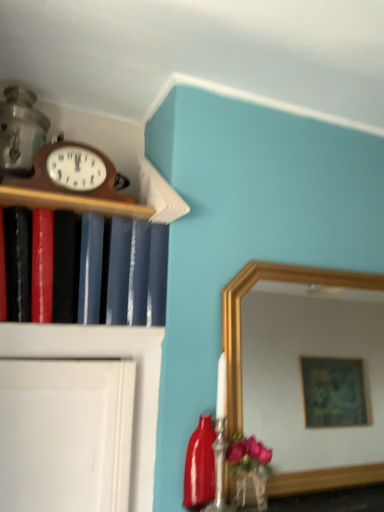
Where is `glossy ceramic bottle at lower right`? Image resolution: width=384 pixels, height=512 pixels. glossy ceramic bottle at lower right is located at coordinates (200, 465).

Is glossy ceramic bottle at lower right turned away from woodenmaterial/texture wall clock at upper left?

No, glossy ceramic bottle at lower right is not facing away from woodenmaterial/texture wall clock at upper left.

Considering the relative sizes of glossy ceramic bottle at lower right and woodenmaterial/texture wall clock at upper left in the image provided, is glossy ceramic bottle at lower right smaller than woodenmaterial/texture wall clock at upper left?

Yes, glossy ceramic bottle at lower right is smaller than woodenmaterial/texture wall clock at upper left.

Can you confirm if glossy ceramic bottle at lower right is positioned to the right of woodenmaterial/texture wall clock at upper left?

Indeed, glossy ceramic bottle at lower right is positioned on the right side of woodenmaterial/texture wall clock at upper left.

You are a GUI agent. You are given a task and a screenshot of the screen. Output one action in this format:
    pyautogui.click(x=<x>, y=<y>)
    Task: Click on the wall clock in front of the glossy ceramic bottle at lower right
    The height and width of the screenshot is (512, 384).
    Given the screenshot: What is the action you would take?
    click(x=71, y=173)

Between matte black book at left and wooden clock at upper left, which one appears on the right side from the viewer's perspective?

From the viewer's perspective, wooden clock at upper left appears more on the right side.

There is a matte black book at left. Identify the location of shelf above it (from a real-world perspective). This screenshot has width=384, height=512. click(71, 202).

Who is more distant, matte black book at left or wooden clock at upper left?

Answer: wooden clock at upper left is behind.

From a real-world perspective, is matte black book at left located higher than wooden clock at upper left?

Incorrect, from a real-world perspective, matte black book at left is lower than wooden clock at upper left.

Is there a large distance between wooden clock at upper left and matte black book at left?

wooden clock at upper left is actually quite close to matte black book at left.

From a real-world perspective, is wooden clock at upper left physically below matte black book at left?

No, from a real-world perspective, wooden clock at upper left is not below matte black book at left.

From the image's perspective, which object appears higher, wooden clock at upper left or matte black book at left?

A: wooden clock at upper left is shown above in the image.

Identify the location of shelf on the right of matte black book at left. This screenshot has height=512, width=384. [x=71, y=202].

Based on the photo, is wooden clock at upper left facing away from woodenmaterial/texture wall clock at upper left?

No, wooden clock at upper left is not facing away from woodenmaterial/texture wall clock at upper left.

Where is `wall clock above the wooden clock at upper left (from a real-world perspective)`? wall clock above the wooden clock at upper left (from a real-world perspective) is located at coordinates (71, 173).

Based on the photo, from the image's perspective, would you say wooden clock at upper left is positioned over woodenmaterial/texture wall clock at upper left?

Incorrect, from the image's perspective, wooden clock at upper left is lower than woodenmaterial/texture wall clock at upper left.

From a real-world perspective, is wooden clock at upper left over woodenmaterial/texture wall clock at upper left?

No, from a real-world perspective, wooden clock at upper left is not over woodenmaterial/texture wall clock at upper left

In the image, is woodenmaterial/texture wall clock at upper left positioned in front of or behind glossy ceramic bottle at lower right?

Visually, woodenmaterial/texture wall clock at upper left is located in front of glossy ceramic bottle at lower right.

From the image's perspective, is woodenmaterial/texture wall clock at upper left located above or below glossy ceramic bottle at lower right?

Based on their image positions, woodenmaterial/texture wall clock at upper left is located above glossy ceramic bottle at lower right.

Is woodenmaterial/texture wall clock at upper left touching glossy ceramic bottle at lower right?

woodenmaterial/texture wall clock at upper left is not next to glossy ceramic bottle at lower right, and they're not touching.

From a real-world perspective, which is physically below, woodenmaterial/texture wall clock at upper left or glossy ceramic bottle at lower right?

glossy ceramic bottle at lower right, from a real-world perspective.

Would you say woodenmaterial/texture wall clock at upper left is outside matte black book at left?

Absolutely, woodenmaterial/texture wall clock at upper left is external to matte black book at left.

I want to click on book in front of the woodenmaterial/texture wall clock at upper left, so click(x=110, y=271).

Is woodenmaterial/texture wall clock at upper left with matte black book at left?

No, woodenmaterial/texture wall clock at upper left is not in contact with matte black book at left.

From the image's perspective, does woodenmaterial/texture wall clock at upper left appear higher than matte black book at left?

Yes, from the image's perspective, woodenmaterial/texture wall clock at upper left is above matte black book at left.

Which is more to the left, glossy ceramic bottle at lower right or matte black book at left?

matte black book at left.

Does point (200, 444) come farther from viewer compared to point (85, 262)?

Yes.

Between glossy ceramic bottle at lower right and matte black book at left, which one has larger width?

matte black book at left is wider.

From the picture: Choose the correct answer: Is glossy ceramic bottle at lower right inside matte black book at left or outside it?

glossy ceramic bottle at lower right cannot be found inside matte black book at left.

I want to click on wall clock above the glossy ceramic bottle at lower right (from the image's perspective), so click(x=71, y=173).

What are the coordinates of `shelf behind the matte black book at left` in the screenshot? It's located at (71, 202).

From the image, which object appears to be nearer to woodenmaterial/texture wall clock at upper left, matte black book at left or wooden clock at upper left?

Based on the image, wooden clock at upper left appears to be nearer to woodenmaterial/texture wall clock at upper left.

Considering their positions, is matte black book at left positioned closer to wooden clock at upper left than glossy ceramic bottle at lower right?

The object closer to wooden clock at upper left is matte black book at left.

Based on their spatial positions, is wooden clock at upper left or woodenmaterial/texture wall clock at upper left closer to matte black book at left?

wooden clock at upper left is positioned closer to the anchor matte black book at left.

Estimate the real-world distances between objects in this image. Which object is closer to glossy ceramic bottle at lower right, wooden clock at upper left or matte black book at left?

Based on the image, matte black book at left appears to be nearer to glossy ceramic bottle at lower right.

Looking at the image, which one is located closer to glossy ceramic bottle at lower right, matte black book at left or wooden clock at upper left?

matte black book at left is closer to glossy ceramic bottle at lower right.

Looking at the image, which one is located closer to glossy ceramic bottle at lower right, matte black book at left or woodenmaterial/texture wall clock at upper left?

matte black book at left lies closer to glossy ceramic bottle at lower right than the other object.

Looking at the image, which one is located further to woodenmaterial/texture wall clock at upper left, matte black book at left or glossy ceramic bottle at lower right?

glossy ceramic bottle at lower right is positioned further to the anchor woodenmaterial/texture wall clock at upper left.

Estimate the real-world distances between objects in this image. Which object is further from matte black book at left, woodenmaterial/texture wall clock at upper left or glossy ceramic bottle at lower right?

Among the two, glossy ceramic bottle at lower right is located further to matte black book at left.

This screenshot has width=384, height=512. Identify the location of shelf between woodenmaterial/texture wall clock at upper left and matte black book at left from top to bottom. coord(71,202).

The height and width of the screenshot is (512, 384). I want to click on shelf between woodenmaterial/texture wall clock at upper left and glossy ceramic bottle at lower right in the up-down direction, so click(71, 202).

Where is `book between wooden clock at upper left and glossy ceramic bottle at lower right vertically`? This screenshot has width=384, height=512. book between wooden clock at upper left and glossy ceramic bottle at lower right vertically is located at coordinates (110, 271).

You are a GUI agent. You are given a task and a screenshot of the screen. Output one action in this format:
    pyautogui.click(x=<x>, y=<y>)
    Task: Click on the book between woodenmaterial/texture wall clock at upper left and glossy ceramic bottle at lower right from top to bottom
    The width and height of the screenshot is (384, 512).
    Given the screenshot: What is the action you would take?
    tap(110, 271)